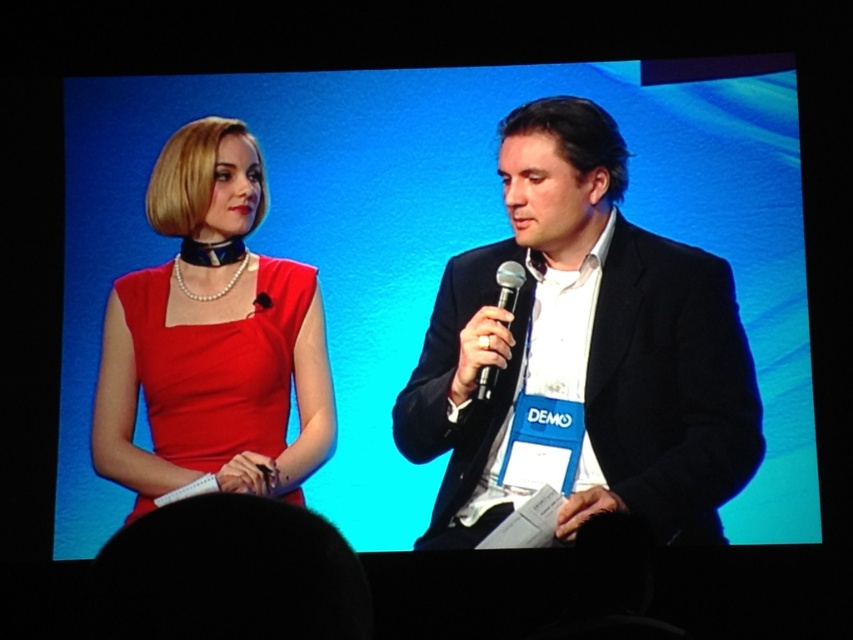
Between matte black microphone at center and black metallic microphone at center, which one has more height?

matte black microphone at center is taller.

Can you confirm if matte black microphone at center is taller than black metallic microphone at center?

Yes.

Which is behind, point (662, 148) or point (480, 376)?

Point (662, 148)

Where is `matte black microphone at center`? matte black microphone at center is located at coordinates (437, 248).

Does matte black microphone at center have a lesser height compared to matte red dress at left?

No.

Can you confirm if matte black microphone at center is wider than matte red dress at left?

Yes, matte black microphone at center is wider than matte red dress at left.

I want to click on matte black microphone at center, so click(437, 248).

What are the coordinates of `matte black microphone at center` in the screenshot? It's located at (437, 248).

Between point (582, 81) and point (602, 460), which one is positioned behind?

The point (582, 81) is behind.

Can you confirm if matte black microphone at center is shorter than black matte suit at center?

Incorrect, matte black microphone at center's height does not fall short of black matte suit at center's.

Between point (672, 180) and point (477, 461), which one is positioned behind?

The point (672, 180) is behind.

Find the location of a particular element. This screenshot has width=853, height=640. matte black microphone at center is located at coordinates (437, 248).